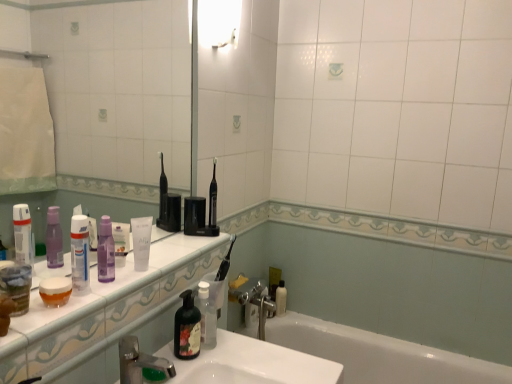
I want to click on vacant space in front of purple translucent mouthwash at center, acting as the first mouthwash starting from the right, so click(98, 292).